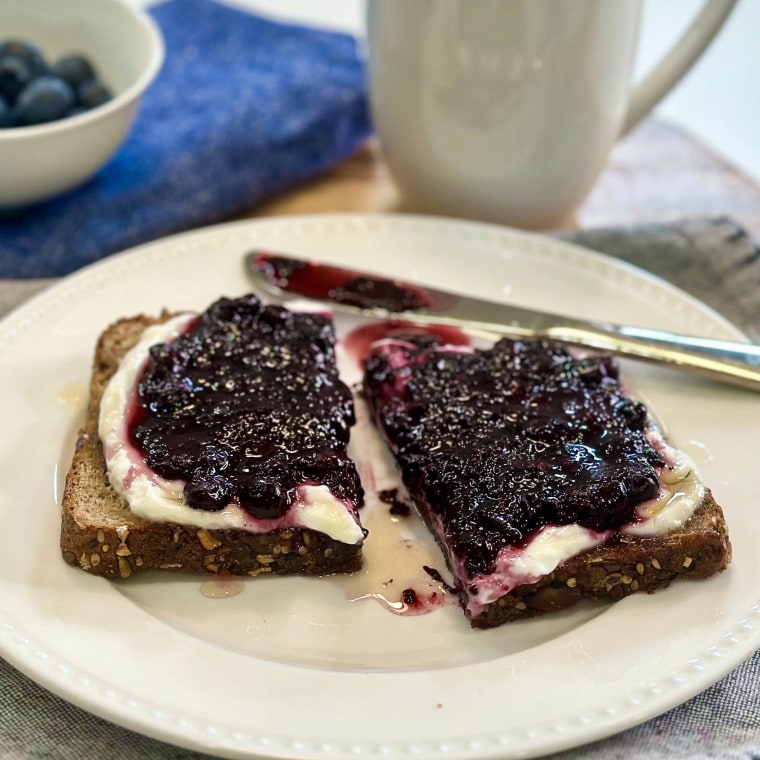
This screenshot has width=760, height=760. I want to click on mug, so click(523, 59).